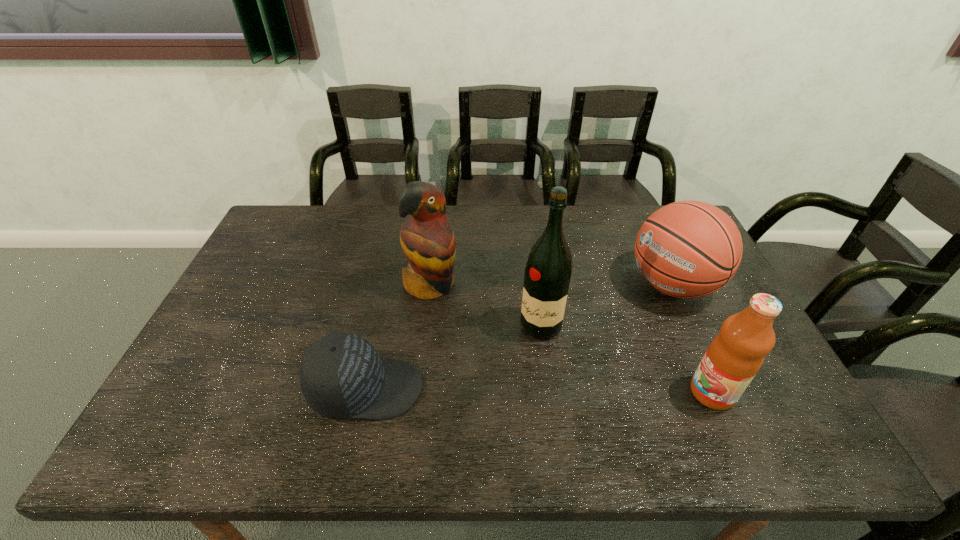
Identify the location of fruit juice situated at the right edge. (734, 357).

The height and width of the screenshot is (540, 960). I want to click on basketball that is at the right edge, so click(x=688, y=249).

This screenshot has width=960, height=540. I want to click on object that is at the near right corner, so click(x=734, y=357).

In the image, there is a desktop. Identify the location of vacant space at the far edge. This screenshot has height=540, width=960. (479, 212).

Identify the location of vacant area at the near edge of the desktop. (549, 385).

At what (x,y) coordinates should I click in order to perform the action: click on vacant region at the left edge of the desktop. Please return your answer as a coordinate pair (x, y). Looking at the image, I should click on (290, 256).

Where is `vacant space at the right edge`? vacant space at the right edge is located at coordinates (718, 303).

Image resolution: width=960 pixels, height=540 pixels. What are the coordinates of `vacant space at the far left corner of the desktop` in the screenshot? It's located at (277, 237).

This screenshot has height=540, width=960. I want to click on vacant space at the near left corner of the desktop, so click(198, 409).

Where is `free space that is in between the liquor and the basketball`? The image size is (960, 540). free space that is in between the liquor and the basketball is located at coordinates (607, 305).